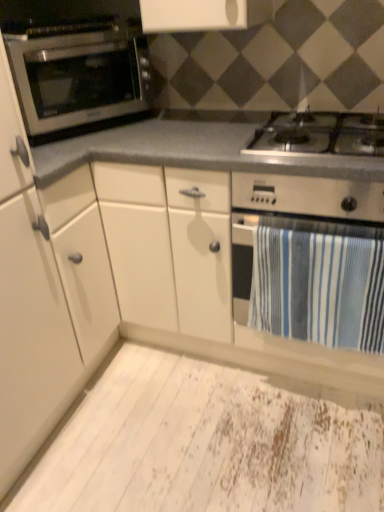
Describe the element at coordinates (319, 287) in the screenshot. I see `blue striped towel at lower right` at that location.

Image resolution: width=384 pixels, height=512 pixels. What are the coordinates of `blue striped towel at lower right` in the screenshot? It's located at (319, 287).

What is the approximate width of stainless steel gas stove at center?

stainless steel gas stove at center is 21.71 inches in width.

Measure the distance between point (113, 87) and camera.

The distance of point (113, 87) from camera is 5.12 feet.

What do you see at coordinates (28, 305) in the screenshot?
I see `white matte cabinet at left` at bounding box center [28, 305].

Locate an element on the screen. The height and width of the screenshot is (512, 384). blue striped towel at lower right is located at coordinates (319, 287).

Which of these two, blue striped towel at lower right or white matte cabinet at left, stands taller?

With more height is white matte cabinet at left.

Considering the relative positions of blue striped towel at lower right and white matte cabinet at left in the image provided, is blue striped towel at lower right to the left or to the right of white matte cabinet at left?

Based on their positions, blue striped towel at lower right is located to the right of white matte cabinet at left.

Is blue striped towel at lower right completely or partially outside of white matte cabinet at left?

Yes, blue striped towel at lower right is located beyond the bounds of white matte cabinet at left.

Which object is thinner, blue striped towel at lower right or white matte cabinet at left?

blue striped towel at lower right.

In the image, is white distressed plywood at lower center on the left side or the right side of white matte cabinet at left?

From the image, it's evident that white distressed plywood at lower center is to the right of white matte cabinet at left.

Considering the sizes of objects white distressed plywood at lower center and white matte cabinet at left in the image provided, who is smaller, white distressed plywood at lower center or white matte cabinet at left?

white distressed plywood at lower center.

Could you tell me if white distressed plywood at lower center is facing white matte cabinet at left?

Yes, white distressed plywood at lower center is aimed at white matte cabinet at left.

Is there a large distance between white distressed plywood at lower center and white matte cabinet at left?

No, there isn't a large distance between white distressed plywood at lower center and white matte cabinet at left.

From the image's perspective, which is below, satin silver oven at left or white matte cabinet at left?

white matte cabinet at left.

Is satin silver oven at left far away from white matte cabinet at left?

No, there isn't a large distance between satin silver oven at left and white matte cabinet at left.

The height and width of the screenshot is (512, 384). Identify the location of cabinetry on the left side of satin silver oven at left. (28, 305).

Can we say blue striped towel at lower right lies outside white distressed plywood at lower center?

Yes, blue striped towel at lower right is not within white distressed plywood at lower center.

Consider the image. From a real-world perspective, which object stands above the other?

In real-world perspective, blue striped towel at lower right is above.

Are blue striped towel at lower right and white distressed plywood at lower center making contact?

No, blue striped towel at lower right is not next to white distressed plywood at lower center.

Is stainless steel gas stove at center facing away from satin silver oven at left?

No, satin silver oven at left is not at the back of stainless steel gas stove at center.

Which object is wider, stainless steel gas stove at center or satin silver oven at left?

Wider between the two is stainless steel gas stove at center.

From a real-world perspective, is stainless steel gas stove at center on top of satin silver oven at left?

Actually, stainless steel gas stove at center is physically below satin silver oven at left in the real world.

Can you confirm if stainless steel gas stove at center is shorter than satin silver oven at left?

Correct, stainless steel gas stove at center is not as tall as satin silver oven at left.

Who is taller, white matte cabinet at left or white distressed plywood at lower center?

Standing taller between the two is white matte cabinet at left.

From the image's perspective, between white matte cabinet at left and white distressed plywood at lower center, which one is located above?

white matte cabinet at left appears higher in the image.

Is white matte cabinet at left far from white distressed plywood at lower center?

No.

Considering the relative positions of blue striped towel at lower right and stainless steel gas stove at center in the image provided, is blue striped towel at lower right in front of stainless steel gas stove at center?

No, blue striped towel at lower right is further to the viewer.

Can you tell me how much blue striped towel at lower right and stainless steel gas stove at center differ in facing direction?

The angular difference between blue striped towel at lower right and stainless steel gas stove at center is 0.968 degrees.

Who is taller, blue striped towel at lower right or stainless steel gas stove at center?

blue striped towel at lower right is taller.

How far apart are blue striped towel at lower right and stainless steel gas stove at center?

A distance of 39.89 centimeters exists between blue striped towel at lower right and stainless steel gas stove at center.

Image resolution: width=384 pixels, height=512 pixels. What are the coordinates of `bath towel behind the white matte cabinet at left` in the screenshot? It's located at (319, 287).

This screenshot has height=512, width=384. In order to click on plywood below the white matte cabinet at left (from a real-world perspective) in this screenshot , I will do click(205, 443).

Which object lies further to the anchor point white distressed plywood at lower center, blue striped towel at lower right or stainless steel gas stove at center?

stainless steel gas stove at center is further to white distressed plywood at lower center.

When comparing their distances from blue striped towel at lower right, does white distressed plywood at lower center or white matte cabinet at left seem closer?

Among the two, white distressed plywood at lower center is located nearer to blue striped towel at lower right.

Estimate the real-world distances between objects in this image. Which object is closer to satin silver oven at left, blue striped towel at lower right or white distressed plywood at lower center?

blue striped towel at lower right.

When comparing their distances from white matte cabinet at left, does blue striped towel at lower right or satin silver oven at left seem closer?

Based on the image, satin silver oven at left appears to be nearer to white matte cabinet at left.

Which object lies further to the anchor point stainless steel gas stove at center, satin silver oven at left or white matte cabinet at left?

white matte cabinet at left.

Based on their spatial positions, is white distressed plywood at lower center or satin silver oven at left closer to stainless steel gas stove at center?

satin silver oven at left is positioned closer to the anchor stainless steel gas stove at center.

From the image, which object appears to be farther from stainless steel gas stove at center, satin silver oven at left or blue striped towel at lower right?

satin silver oven at left is positioned further to the anchor stainless steel gas stove at center.

Considering their positions, is stainless steel gas stove at center positioned further to satin silver oven at left than white matte cabinet at left?

stainless steel gas stove at center lies further to satin silver oven at left than the other object.

You are a GUI agent. You are given a task and a screenshot of the screen. Output one action in this format:
    pyautogui.click(x=<x>, y=<y>)
    Task: Click on the bath towel between stainless steel gas stove at center and white distressed plywood at lower center from top to bottom
    
    Given the screenshot: What is the action you would take?
    pyautogui.click(x=319, y=287)

Find the location of a particular element. plywood between white matte cabinet at left and blue striped towel at lower right from left to right is located at coordinates tap(205, 443).

You are a GUI agent. You are given a task and a screenshot of the screen. Output one action in this format:
    pyautogui.click(x=<x>, y=<y>)
    Task: Click on the gas stove that lies between satin silver oven at left and white distressed plywood at lower center from top to bottom
    The width and height of the screenshot is (384, 512).
    Given the screenshot: What is the action you would take?
    pyautogui.click(x=320, y=134)

Where is `oven between white matte cabinet at left and blue striped towel at lower right from left to right`? This screenshot has width=384, height=512. oven between white matte cabinet at left and blue striped towel at lower right from left to right is located at coordinates (78, 73).